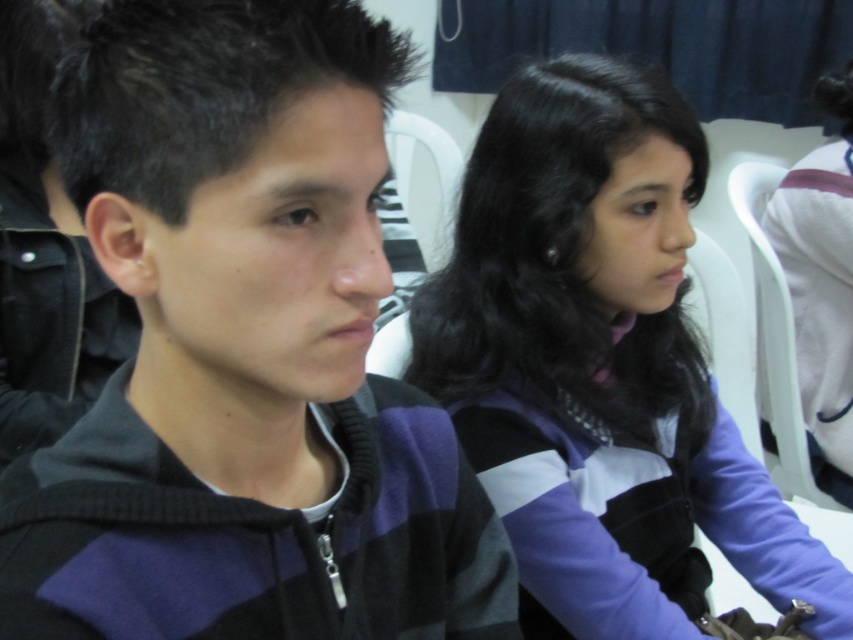
You are standing in a classroom and see the black striped sweater at center. Can you tell me its exact position using coordinates?

The black striped sweater at center is located at coordinates point (244, 353).